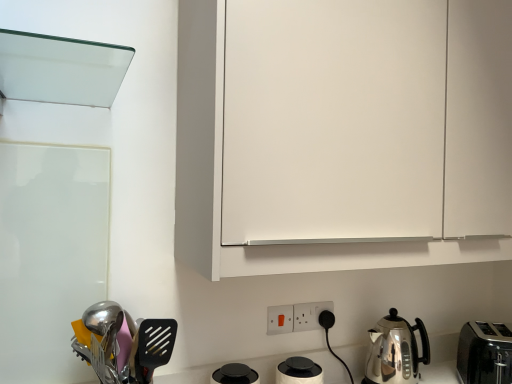
Image resolution: width=512 pixels, height=384 pixels. In order to click on white plastic electric outlet at lower center, which is the 1th electric outlet from left to right in this screenshot , I will do `click(279, 319)`.

This screenshot has height=384, width=512. What do you see at coordinates (124, 344) in the screenshot?
I see `polished stainless steel utensils at lower left` at bounding box center [124, 344].

Describe the element at coordinates (342, 133) in the screenshot. I see `white matte cabinet at upper center` at that location.

Measure the distance between point (502, 351) and camera.

Point (502, 351) is 1.50 meters from camera.

Image resolution: width=512 pixels, height=384 pixels. What do you see at coordinates (309, 315) in the screenshot?
I see `white plastic electric outlet at lower center, the 1th electric outlet viewed from the back` at bounding box center [309, 315].

In order to click on white plastic electric outlet at lower center, which is the 1th electric outlet from left to right in this screenshot , I will do `click(279, 319)`.

Is white plastic electric outlet at lower center, the 1th electric outlet viewed from the back, behind white plastic electric outlet at lower center, which ranks as the second electric outlet in back-to-front order?

Yes, white plastic electric outlet at lower center, the 1th electric outlet viewed from the back, is further from the camera.

Which of these two, white plastic electric outlet at lower center, the second electric outlet viewed from the left, or white plastic electric outlet at lower center, which is the 1th electric outlet from left to right, stands taller?

With more height is white plastic electric outlet at lower center, which is the 1th electric outlet from left to right.

The height and width of the screenshot is (384, 512). Find the location of `electric outlet located on the left of white plastic electric outlet at lower center, the 1th electric outlet viewed from the back`. electric outlet located on the left of white plastic electric outlet at lower center, the 1th electric outlet viewed from the back is located at coordinates (279, 319).

Is white plastic electric outlet at lower center, the second electric outlet viewed from the left, at the left side of white plastic electric outlet at lower center, the second electric outlet viewed from the right?

No, white plastic electric outlet at lower center, the second electric outlet viewed from the left, is not to the left of white plastic electric outlet at lower center, the second electric outlet viewed from the right.

Find the location of a particular element. The height and width of the screenshot is (384, 512). kitchen appliance on the right of white plastic electric outlet at lower center, the 1th electric outlet from the front is located at coordinates (395, 350).

From a real-world perspective, is white plastic electric outlet at lower center, which ranks as the second electric outlet in back-to-front order, positioned above or below satin silver kettle at lower right?

In terms of real-world spatial position, white plastic electric outlet at lower center, which ranks as the second electric outlet in back-to-front order, is above satin silver kettle at lower right.

Which object is closer to the camera, white plastic electric outlet at lower center, which is the 1th electric outlet from left to right, or satin silver kettle at lower right?

satin silver kettle at lower right.

Looking at their sizes, would you say white plastic electric outlet at lower center, which ranks as the second electric outlet in back-to-front order, is wider or thinner than satin silver kettle at lower right?

In the image, white plastic electric outlet at lower center, which ranks as the second electric outlet in back-to-front order, appears to be more narrow than satin silver kettle at lower right.

Can you confirm if white plastic electric outlet at lower center, the first electric outlet when ordered from right to left, is thinner than polished stainless steel utensils at lower left?

Correct, the width of white plastic electric outlet at lower center, the first electric outlet when ordered from right to left, is less than that of polished stainless steel utensils at lower left.

Is white plastic electric outlet at lower center, positioned as the second electric outlet in front-to-back order, situated inside polished stainless steel utensils at lower left or outside?

white plastic electric outlet at lower center, positioned as the second electric outlet in front-to-back order, is located beyond the bounds of polished stainless steel utensils at lower left.

Locate an element on the screen. The height and width of the screenshot is (384, 512). the 2nd electric outlet behind the polished stainless steel utensils at lower left, starting your count from the anchor is located at coordinates (309, 315).

Identify the location of cabinetry that appears on the right of white plastic electric outlet at lower center, which ranks as the second electric outlet in back-to-front order. This screenshot has width=512, height=384. (342, 133).

How many degrees apart are the facing directions of white plastic electric outlet at lower center, which ranks as the second electric outlet in back-to-front order, and white matte cabinet at upper center?

0.341 degrees.

Considering the positions of point (273, 332) and point (294, 19), is point (273, 332) closer or farther from the camera than point (294, 19)?

Point (273, 332) is positioned farther from the camera compared to point (294, 19).

Can we say white plastic electric outlet at lower center, the first electric outlet when ordered from right to left, lies outside white matte cabinet at upper center?

Indeed, white plastic electric outlet at lower center, the first electric outlet when ordered from right to left, is completely outside white matte cabinet at upper center.

Could you tell me if white plastic electric outlet at lower center, the second electric outlet viewed from the left, is turned towards white matte cabinet at upper center?

No.

Consider the image. Considering their positions, is white plastic electric outlet at lower center, the second electric outlet viewed from the left, located in front of or behind white matte cabinet at upper center?

In the image, white plastic electric outlet at lower center, the second electric outlet viewed from the left, appears behind white matte cabinet at upper center.

How many degrees apart are the facing directions of white plastic electric outlet at lower center, the first electric outlet when ordered from right to left, and white matte cabinet at upper center?

The angular difference between white plastic electric outlet at lower center, the first electric outlet when ordered from right to left, and white matte cabinet at upper center is 0.34 degrees.

Considering the positions of objects white matte cabinet at upper center and satin silver kettle at lower right in the image provided, who is more to the right, white matte cabinet at upper center or satin silver kettle at lower right?

satin silver kettle at lower right is more to the right.

Between point (206, 229) and point (413, 343), which one is positioned behind?

The point (413, 343) is farther from the camera.

Could you tell me if white matte cabinet at upper center is turned towards satin silver kettle at lower right?

No, white matte cabinet at upper center is not aimed at satin silver kettle at lower right.

Where is `kitchen appliance behind the white matte cabinet at upper center`? This screenshot has width=512, height=384. kitchen appliance behind the white matte cabinet at upper center is located at coordinates (395, 350).

Considering the positions of point (479, 378) and point (507, 133), is point (479, 378) closer or farther from the camera than point (507, 133)?

Point (479, 378) is farther from the camera than point (507, 133).

Does black plastic toaster at lower right come in front of white matte cabinet at upper center?

No, it is not.

Between black plastic toaster at lower right and white matte cabinet at upper center, which one appears on the right side from the viewer's perspective?

black plastic toaster at lower right is more to the right.

From a real-world perspective, does black plastic toaster at lower right stand above white matte cabinet at upper center?

No, from a real-world perspective, black plastic toaster at lower right is not over white matte cabinet at upper center

Identify the location of electric outlet that appears on the right of white plastic electric outlet at lower center, which is the 1th electric outlet from left to right. (309, 315).

Locate an element on the screen. This screenshot has height=384, width=512. kitchen appliance that appears below the white plastic electric outlet at lower center, which ranks as the second electric outlet in back-to-front order (from a real-world perspective) is located at coordinates (x=395, y=350).

Which object lies nearer to the anchor point satin silver kettle at lower right, white matte cabinet at upper center or polished stainless steel utensils at lower left?

The object closer to satin silver kettle at lower right is white matte cabinet at upper center.

Consider the image. From the image, which object appears to be nearer to polished stainless steel utensils at lower left, satin silver kettle at lower right or white plastic electric outlet at lower center, the second electric outlet viewed from the left?

white plastic electric outlet at lower center, the second electric outlet viewed from the left, is positioned closer to the anchor polished stainless steel utensils at lower left.

Which object lies further to the anchor point black plastic toaster at lower right, white plastic electric outlet at lower center, the first electric outlet when ordered from right to left, or satin silver kettle at lower right?

white plastic electric outlet at lower center, the first electric outlet when ordered from right to left, is positioned further to the anchor black plastic toaster at lower right.

When comparing their distances from white plastic electric outlet at lower center, the second electric outlet viewed from the left, does satin silver kettle at lower right or polished stainless steel utensils at lower left seem closer?

Among the two, satin silver kettle at lower right is located nearer to white plastic electric outlet at lower center, the second electric outlet viewed from the left.

Estimate the real-world distances between objects in this image. Which object is further from satin silver kettle at lower right, white plastic electric outlet at lower center, the 1th electric outlet viewed from the back, or polished stainless steel utensils at lower left?

polished stainless steel utensils at lower left lies further to satin silver kettle at lower right than the other object.

Looking at this image, estimate the real-world distances between objects in this image. Which object is closer to black plastic toaster at lower right, satin silver kettle at lower right or white matte cabinet at upper center?

Based on the image, satin silver kettle at lower right appears to be nearer to black plastic toaster at lower right.

When comparing their distances from white plastic electric outlet at lower center, the first electric outlet when ordered from right to left, does white plastic electric outlet at lower center, the 1th electric outlet from the front, or satin silver kettle at lower right seem further?

Among the two, satin silver kettle at lower right is located further to white plastic electric outlet at lower center, the first electric outlet when ordered from right to left.

Looking at the image, which one is located further to white plastic electric outlet at lower center, the 1th electric outlet viewed from the back, polished stainless steel utensils at lower left or white matte cabinet at upper center?

Among the two, white matte cabinet at upper center is located further to white plastic electric outlet at lower center, the 1th electric outlet viewed from the back.

Where is `cabinetry between polished stainless steel utensils at lower left and satin silver kettle at lower right in the horizontal direction`? This screenshot has width=512, height=384. cabinetry between polished stainless steel utensils at lower left and satin silver kettle at lower right in the horizontal direction is located at coordinates (342, 133).

Where is `cabinetry between polished stainless steel utensils at lower left and black plastic toaster at lower right`? This screenshot has height=384, width=512. cabinetry between polished stainless steel utensils at lower left and black plastic toaster at lower right is located at coordinates (342, 133).

Locate an element on the screen. The height and width of the screenshot is (384, 512). silverware that lies between white matte cabinet at upper center and white plastic electric outlet at lower center, the first electric outlet when ordered from right to left, from top to bottom is located at coordinates (124, 344).

Where is `electric outlet between white plastic electric outlet at lower center, the second electric outlet viewed from the right, and black plastic toaster at lower right from left to right`? This screenshot has height=384, width=512. electric outlet between white plastic electric outlet at lower center, the second electric outlet viewed from the right, and black plastic toaster at lower right from left to right is located at coordinates 309,315.